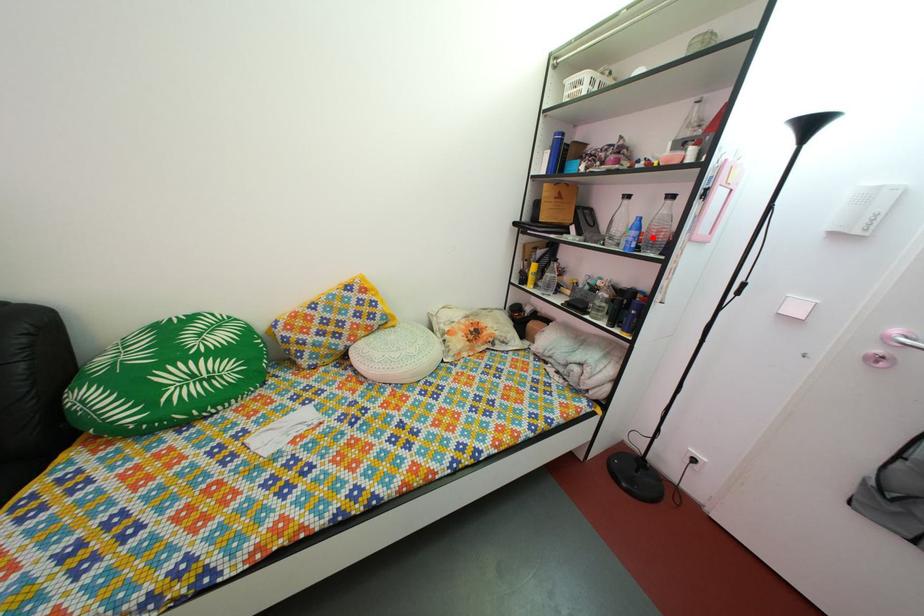
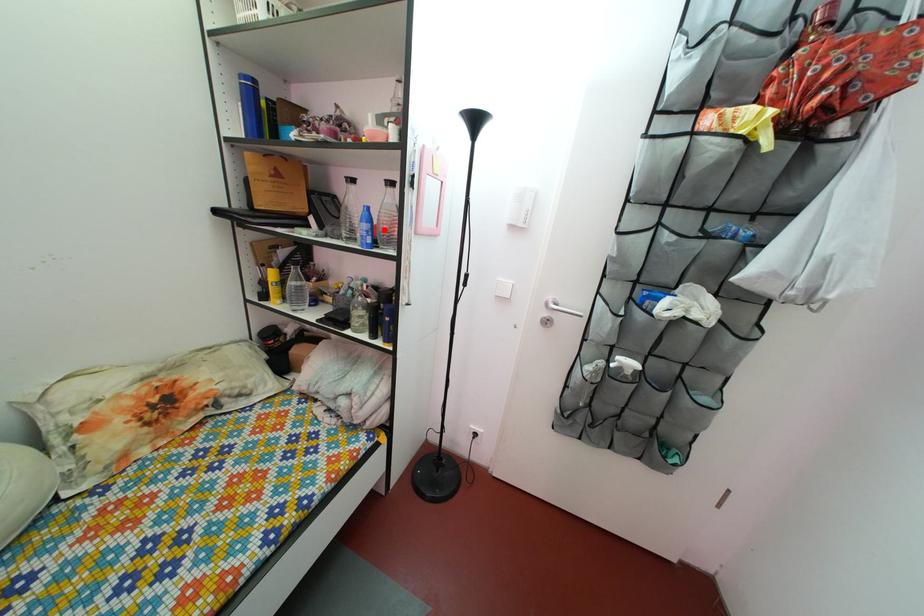
I am providing you with two images of the same scene from different viewpoints. A red point is marked on the first image and another point is marked on the second image. Is the marked point in image1 the same physical position as the marked point in image2?

Yes